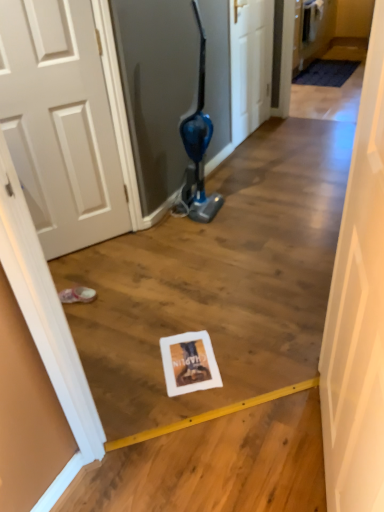
Question: Do you think white matte door at center, which ranks as the first door in front-to-back order, is within white wood door at center, the second door when ordered from bottom to top, or outside of it?

Choices:
 (A) inside
 (B) outside

Answer: (B)

Question: From the image's perspective, relative to white wood door at center, which appears as the 2th door when viewed from the front, is white matte door at center, which is the second door from top to bottom, above or below?

Choices:
 (A) above
 (B) below

Answer: (B)

Question: Which object is positioned closest to the white wood door at center, the second door when ordered from bottom to top?

Choices:
 (A) pink fabric footwear at lower left
 (B) white matte door at center, the second door from the back

Answer: (A)

Question: Which object is positioned closest to the pink fabric footwear at lower left?

Choices:
 (A) white matte door at center, the second door from the back
 (B) white wood door at center, acting as the 1th door starting from the top

Answer: (A)